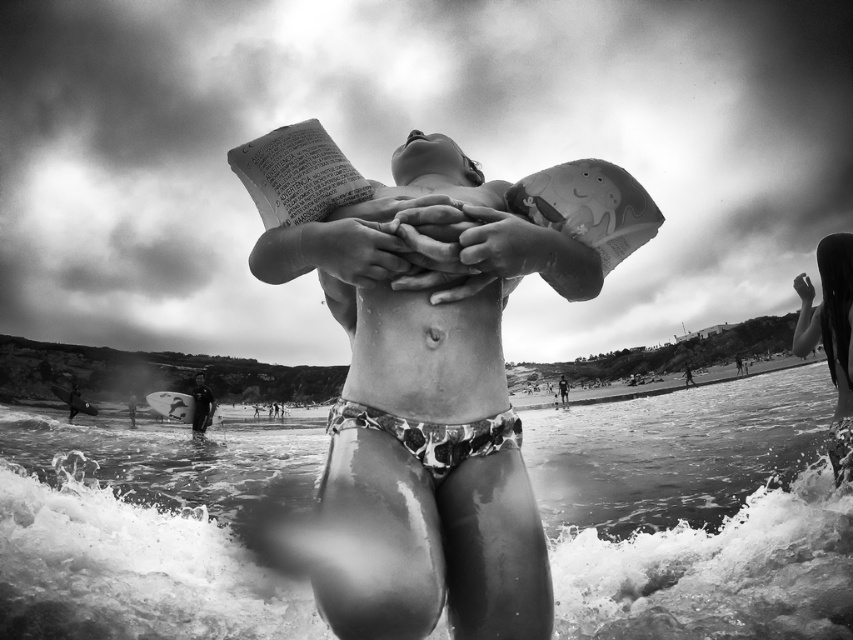
The width and height of the screenshot is (853, 640). Identify the location of wet sand at lower center. (695, 513).

Image resolution: width=853 pixels, height=640 pixels. What are the coordinates of `wet sand at lower center` in the screenshot? It's located at (695, 513).

This screenshot has width=853, height=640. Find the location of `wet sand at lower center`. wet sand at lower center is located at coordinates (695, 513).

Between printed paper towel at center and printed fabric bikini at center, which one appears on the left side from the viewer's perspective?

printed paper towel at center is more to the left.

Does printed paper towel at center have a larger size compared to printed fabric bikini at center?

Correct, printed paper towel at center is larger in size than printed fabric bikini at center.

The height and width of the screenshot is (640, 853). What do you see at coordinates (427, 404) in the screenshot?
I see `printed paper towel at center` at bounding box center [427, 404].

Where is `printed paper towel at center`? printed paper towel at center is located at coordinates (427, 404).

Can you confirm if printed paper towel at center is thinner than smooth skin child at right?

In fact, printed paper towel at center might be wider than smooth skin child at right.

Is point (520, 483) closer to viewer compared to point (846, 353)?

That is True.

The width and height of the screenshot is (853, 640). I want to click on printed paper towel at center, so click(427, 404).